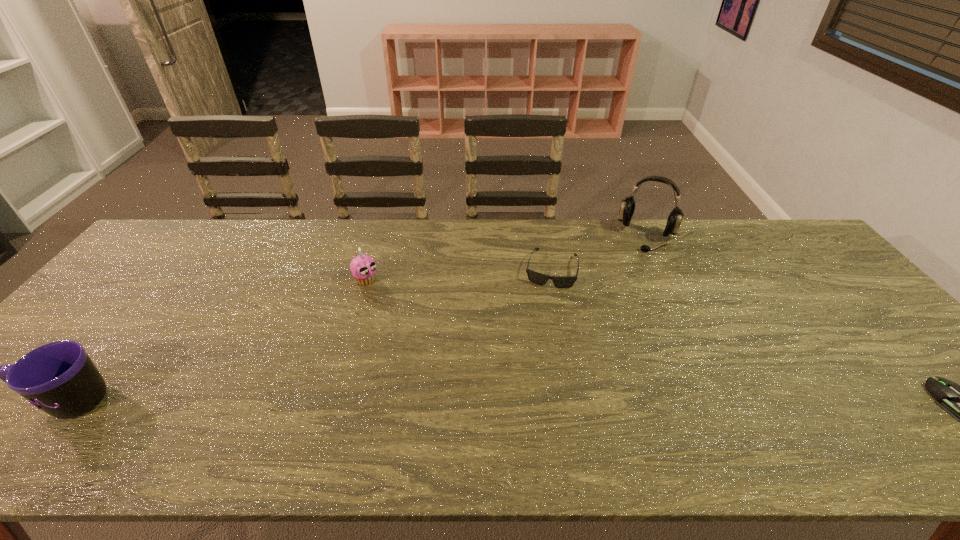
This screenshot has height=540, width=960. Find the location of `vacant space on the desktop that is between the leftmost object and the rightmost object and is positioned on the front-facing side of the fourth tallest object`. vacant space on the desktop that is between the leftmost object and the rightmost object and is positioned on the front-facing side of the fourth tallest object is located at coordinates tap(524, 402).

Image resolution: width=960 pixels, height=540 pixels. I want to click on vacant space on the desktop that is between the leftmost object and the shortest object and is positioned on the face of the cupcake, so click(x=516, y=402).

This screenshot has height=540, width=960. What are the coordinates of `free space on the desktop that is between the mug and the shortest object and is positioned with the microphone on the side of the headset` in the screenshot? It's located at (582, 402).